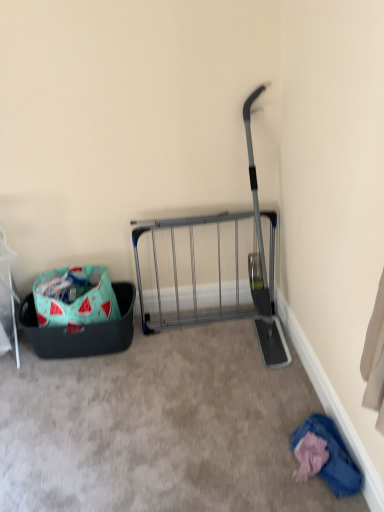
Question: Looking at their shapes, would you say blue cotton shirt at lower right is wider or thinner than watermelon-patterned fabric bag at lower left?

Choices:
 (A) thin
 (B) wide

Answer: (A)

Question: Considering their positions, is blue cotton shirt at lower right located in front of or behind watermelon-patterned fabric bag at lower left?

Choices:
 (A) behind
 (B) front

Answer: (B)

Question: Considering the real-world distances, which object is closest to the blue cotton shirt at lower right?

Choices:
 (A) teal fabric laundry basket at lower left
 (B) metallic gray rack at center
 (C) watermelon-patterned fabric bag at lower left

Answer: (B)

Question: Estimate the real-world distances between objects in this image. Which object is closer to the watermelon-patterned fabric bag at lower left?

Choices:
 (A) teal fabric laundry basket at lower left
 (B) blue cotton shirt at lower right
 (C) metallic gray rack at center

Answer: (A)